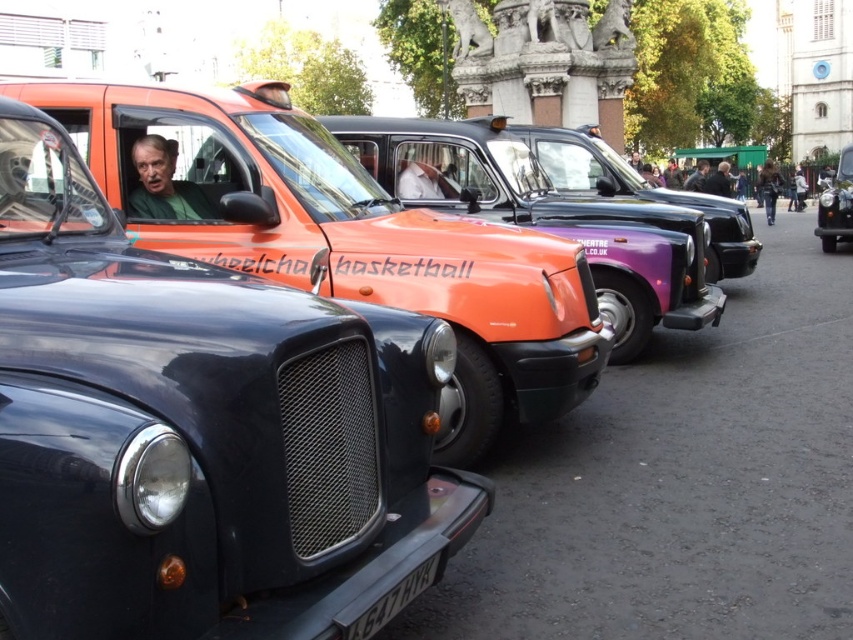
You are standing at the intersection and need to locate the orange matte taxi at center. According to the coordinates provided, where exactly is it positioned?

The orange matte taxi at center is located at point (558, 220).

You are a photographer standing in front of the orange matte taxi at center and the green fabric shirt at center. You want to capture a photo where both subjects are in focus. Which subject should you focus on to ensure both are sharp?

A: The orange matte taxi at center is bigger than the green fabric shirt at center. To ensure both are in focus, focus on the orange matte taxi at center since it is closer to you.